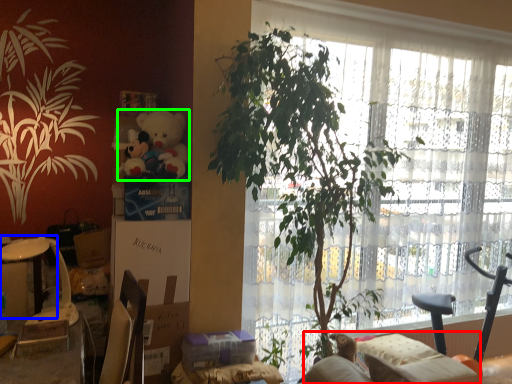
Question: Which object is the farthest from couch (highlighted by a red box)? Choose among these: table (highlighted by a blue box) or toy (highlighted by a green box).

Choices:
 (A) table
 (B) toy

Answer: (A)